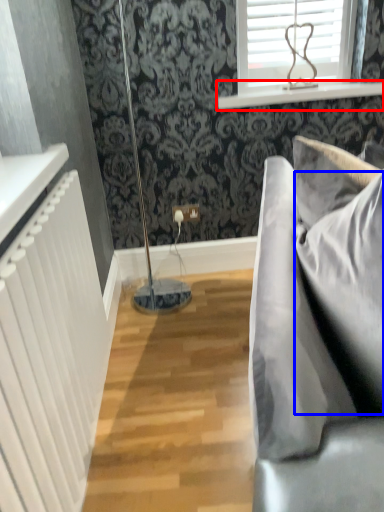
Question: Which of the following is the farthest to the observer, window sill (highlighted by a red box) or pillow (highlighted by a blue box)?

Choices:
 (A) window sill
 (B) pillow

Answer: (A)